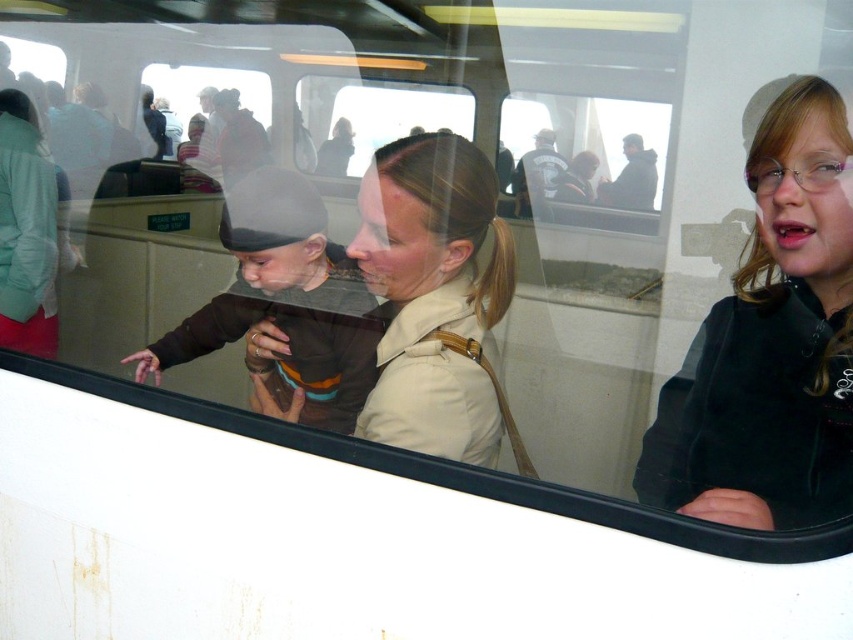
You are standing outside the ferry and looking through the window. You want to locate the black matte jacket at right. Where exactly is it positioned relative to the window?

The black matte jacket at right is located at point (770,344) relative to the window.

Consider the image. You are a passenger on the ferry and want to know if your new smartphone, which is 1 cm thick, can fit in the space between the beige leather jacket at center and the transparent glass at center. Can it fit?

The beige leather jacket at center is thinner than the transparent glass at center. Since the smartphone is 1 cm thick, it can fit in the space between them as the jacket is thinner than the glass, creating enough space.

You are a passenger on a ferry and want to see the view outside through the window. You are sitting in a dark gray jacket at upper center. Is there an obstruction between you and the transparent glass at center?

The transparent glass at center is above the dark gray jacket at upper center, so there is no obstruction between you and the transparent glass at center. You can see the view outside through the window.